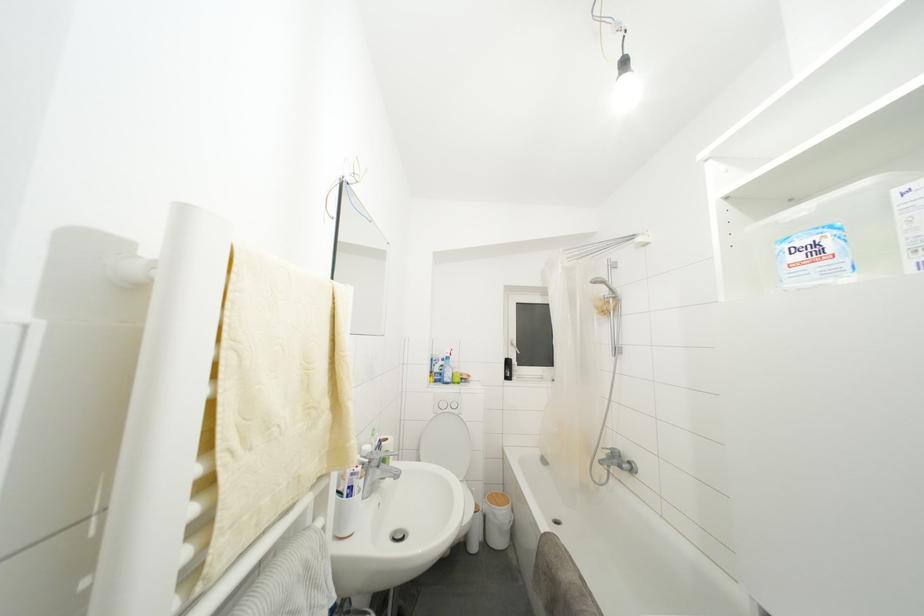
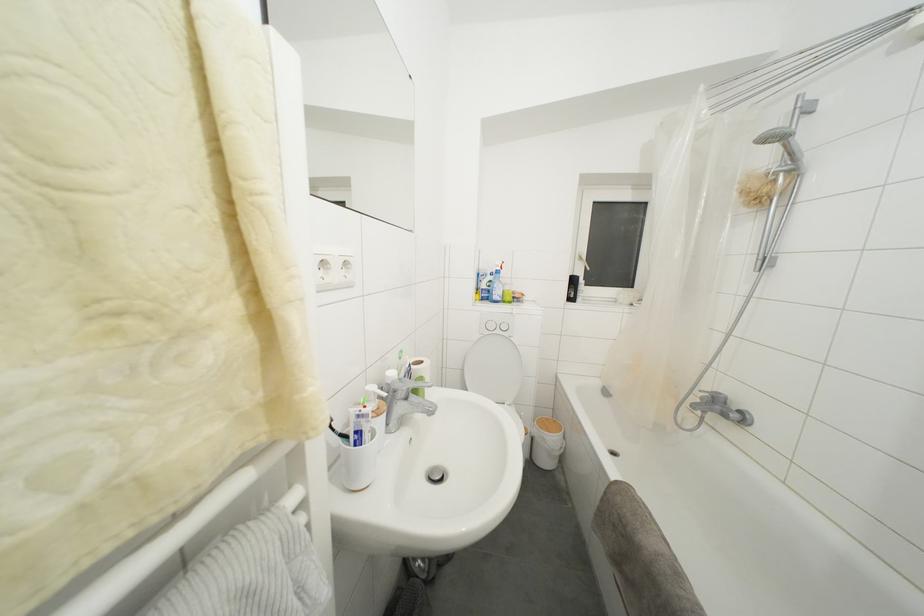
Question: How did the camera likely rotate?

Choices:
 (A) Left
 (B) Right
 (C) Up
 (D) Down

Answer: (D)